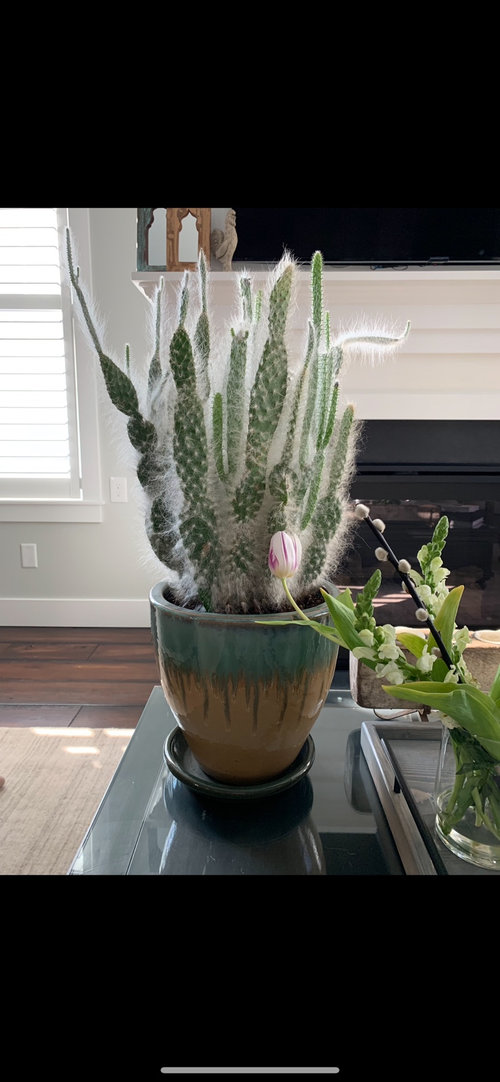
Where is `ceramic`? The image size is (500, 1082). ceramic is located at coordinates (192, 775).